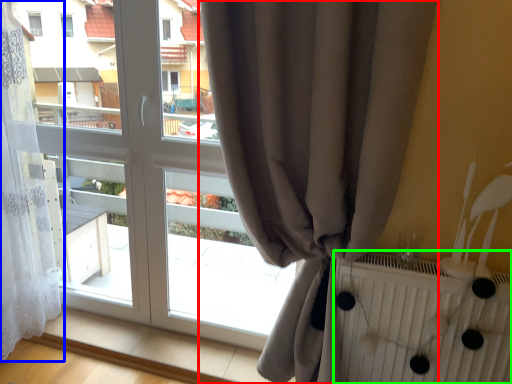
Question: Based on their relative distances, which object is farther from curtain (highlighted by a red box)? Choose from curtain (highlighted by a blue box) and radiator (highlighted by a green box).

Choices:
 (A) curtain
 (B) radiator

Answer: (A)